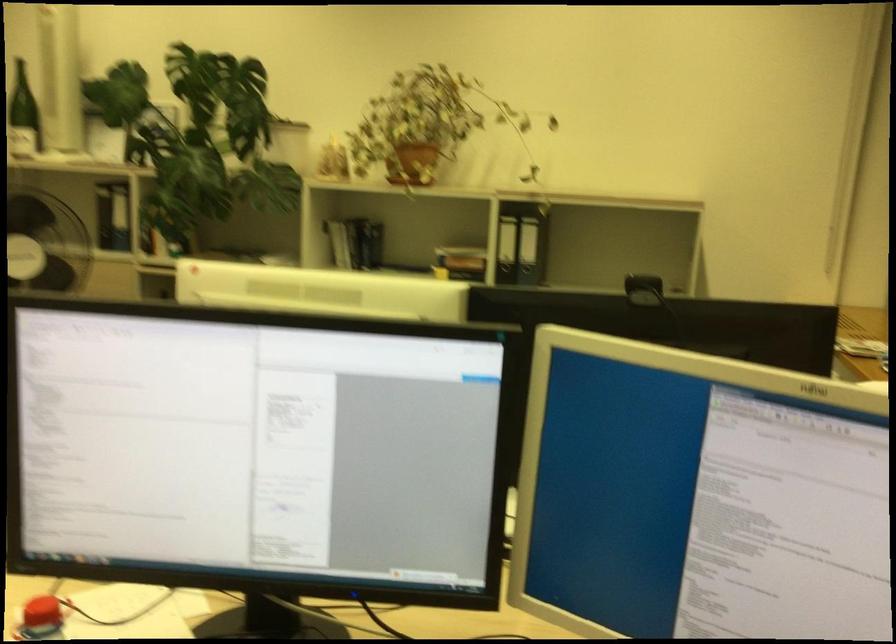
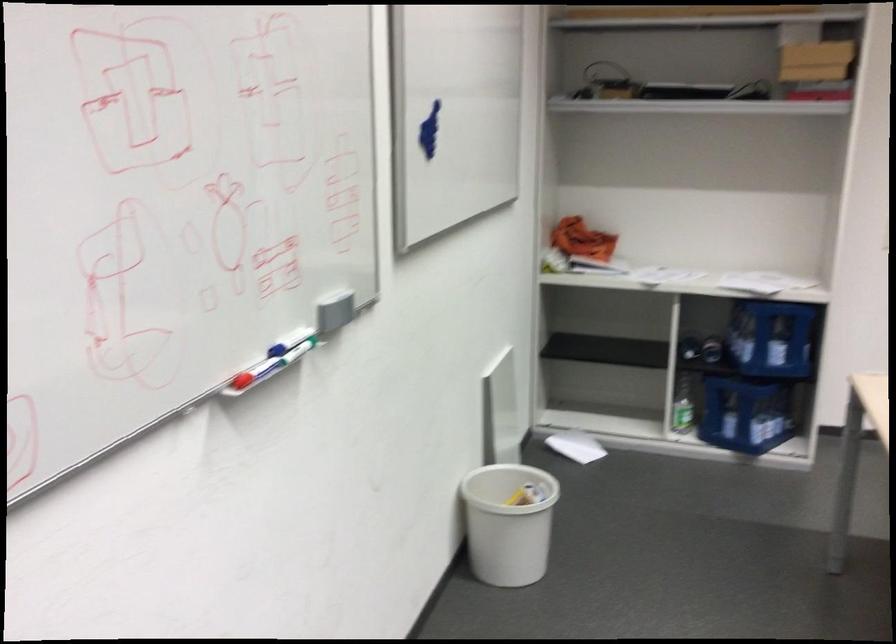
Question: The camera is either moving clockwise (left) or counter-clockwise (right) around the object. The first image is from the beginning of the video and the second image is from the end. Is the camera moving left or right when shooting the video?

Choices:
 (A) Left
 (B) Right

Answer: (B)